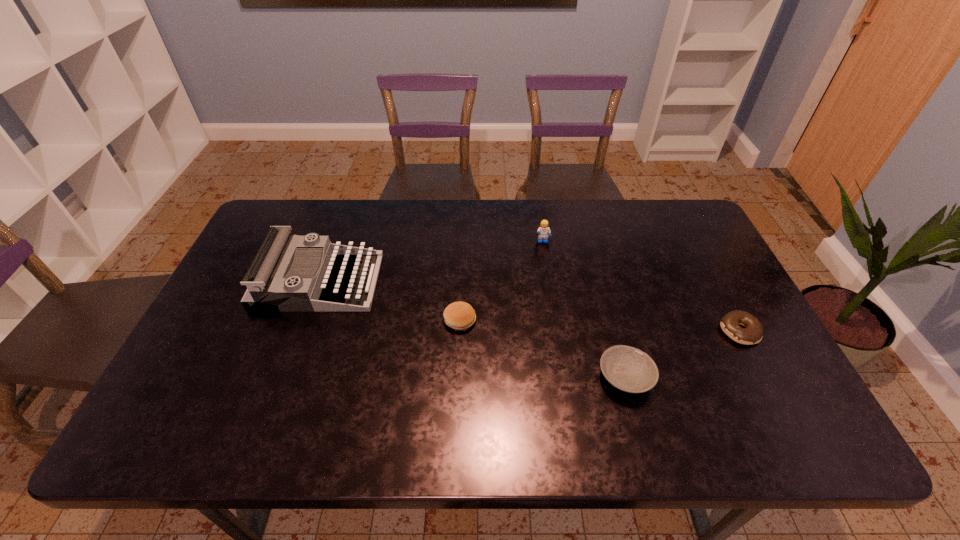
The width and height of the screenshot is (960, 540). Find the location of `the leftmost object`. the leftmost object is located at coordinates (270, 287).

I want to click on typewriter, so click(x=270, y=287).

Locate an element on the screen. Image resolution: width=960 pixels, height=540 pixels. the fourth shortest object is located at coordinates (543, 231).

Locate an element on the screen. the farthest object is located at coordinates pyautogui.click(x=543, y=231).

At what (x,y) coordinates should I click in order to perform the action: click on the second object from left to right. Please return your answer as a coordinate pair (x, y). Image resolution: width=960 pixels, height=540 pixels. Looking at the image, I should click on pos(459,316).

The height and width of the screenshot is (540, 960). I want to click on bowl, so (628, 369).

Locate an element on the screen. The image size is (960, 540). the nearest object is located at coordinates (628, 369).

I want to click on the rightmost object, so click(x=752, y=334).

Image resolution: width=960 pixels, height=540 pixels. Identify the location of free point located on the typing side of the tallest object. (421, 281).

Identify the location of vacant space situated on the front-facing side of the farthest object. Image resolution: width=960 pixels, height=540 pixels. (546, 264).